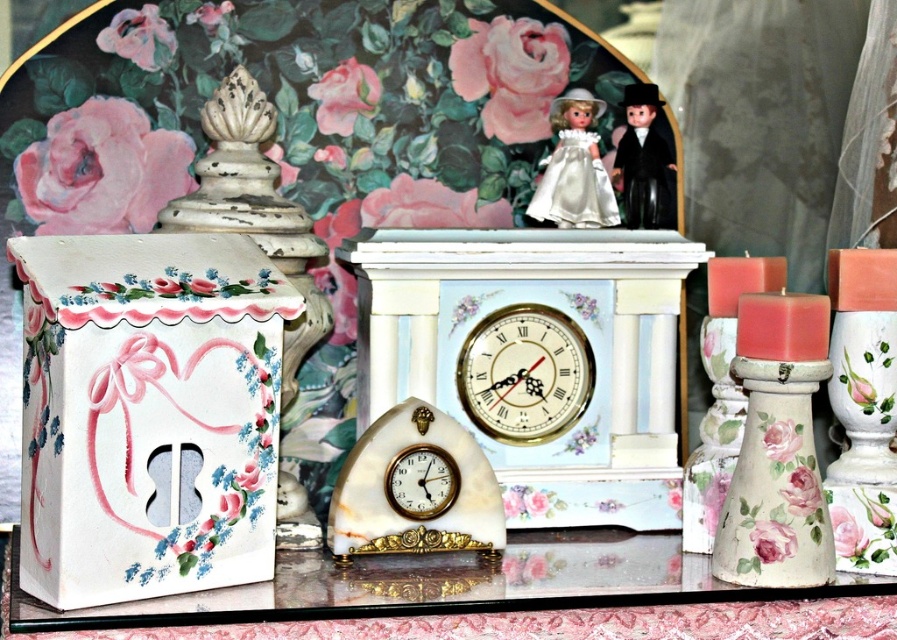
Based on the photo, does white marble table at center have a smaller size compared to gold metallic clock at center?

No.

Identify the location of white marble table at center. (442, 584).

Does point (632, 580) lie in front of point (410, 515)?

Yes, point (632, 580) is closer to viewer.

I want to click on white marble table at center, so click(442, 584).

What do you see at coordinates (442, 584) in the screenshot?
I see `white marble table at center` at bounding box center [442, 584].

Does point (551, 579) lie behind point (558, 212)?

No, (551, 579) is closer to viewer.

At what (x,y) coordinates should I click in order to perform the action: click on white marble table at center. Please return your answer as a coordinate pair (x, y). This screenshot has width=897, height=640. Looking at the image, I should click on (442, 584).

Who is more distant from viewer, (529,397) or (417,502)?

The point (529,397) is behind.

Describe the element at coordinates (525, 372) in the screenshot. I see `white marble clock at center` at that location.

Find the location of `white marble clock at center`. white marble clock at center is located at coordinates (525, 372).